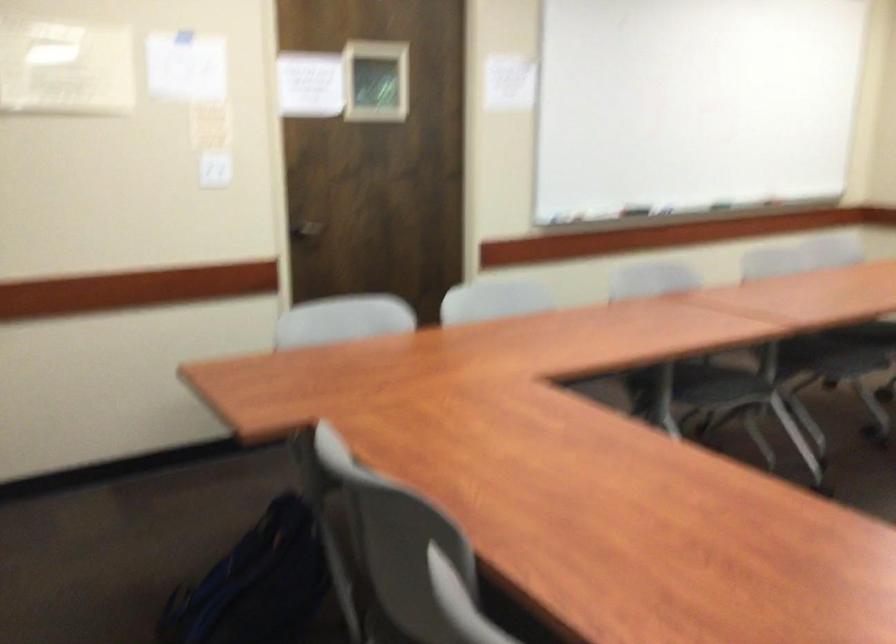
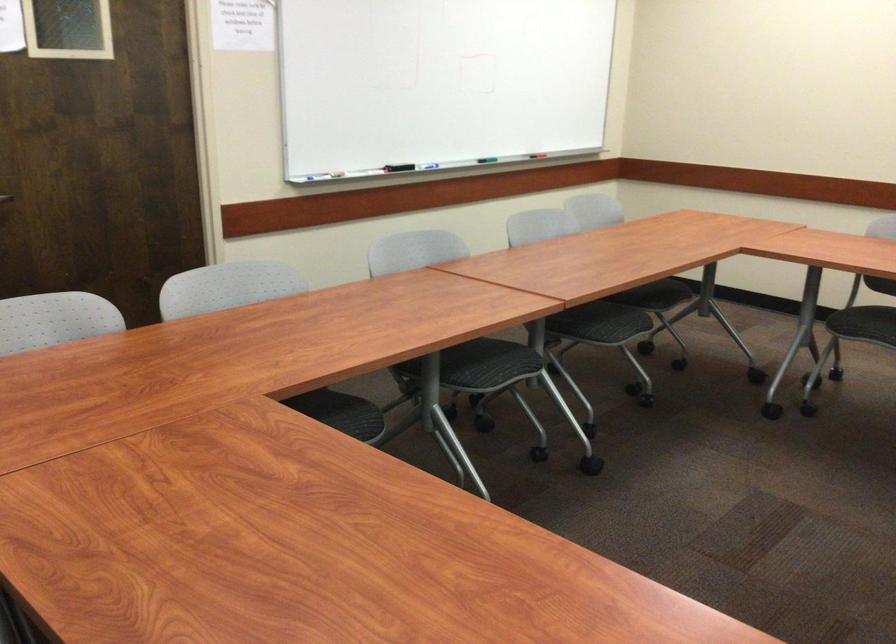
Locate, in the second image, the point that corresponds to (x=322, y=229) in the first image.

(5, 198)